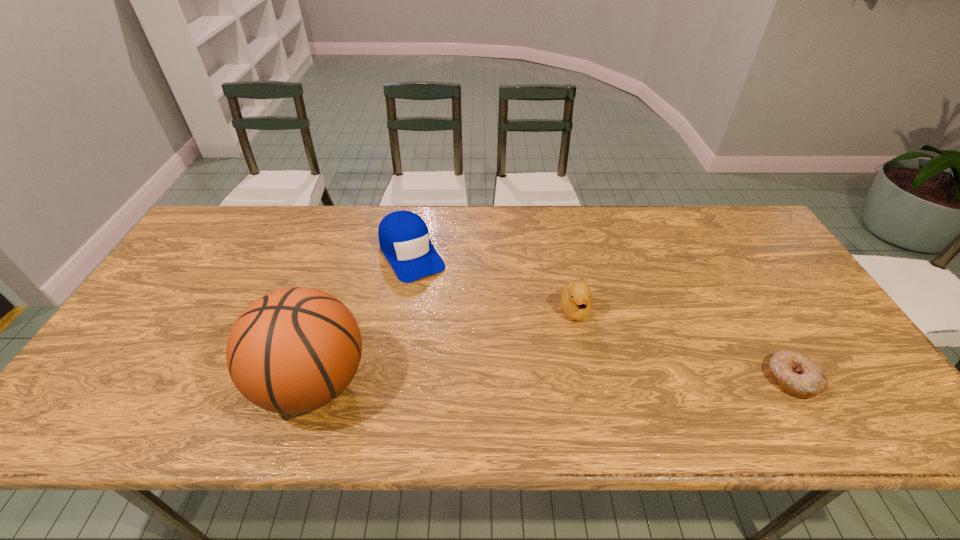
Locate an element on the screen. Image resolution: width=960 pixels, height=540 pixels. unoccupied position between the doughnut and the farthest object is located at coordinates (602, 316).

Identify the location of free spot between the third nearest object and the tallest object. (444, 346).

Where is `free space between the farthest object and the shortest object`? free space between the farthest object and the shortest object is located at coordinates (602, 316).

Locate which object ranks third in proximity to the second object from right to left. Please provide its 2D coordinates. Your answer should be formatted as a tuple, i.e. [(x, y)], where the tuple contains the x and y coordinates of a point satisfying the conditions above.

[(292, 351)]

Identify which object is located as the nearest to the doughnut. Please provide its 2D coordinates. Your answer should be formatted as a tuple, i.e. [(x, y)], where the tuple contains the x and y coordinates of a point satisfying the conditions above.

[(575, 297)]

The width and height of the screenshot is (960, 540). Identify the location of vacant position in the image that satisfies the following two spatial constraints: 1. on the back side of the basketball; 2. on the right side of the second farthest object. (336, 310).

The height and width of the screenshot is (540, 960). What are the coordinates of `free space in the image that satisfies the following two spatial constraints: 1. on the back side of the basketball; 2. on the right side of the doughnut` in the screenshot? It's located at (314, 379).

At what (x,y) coordinates should I click in order to perform the action: click on free space that satisfies the following two spatial constraints: 1. on the front side of the baseball cap; 2. on the left side of the rightmost object. Please return your answer as a coordinate pair (x, y). This screenshot has height=540, width=960. Looking at the image, I should click on (391, 379).

At what (x,y) coordinates should I click in order to perform the action: click on vacant region that satisfies the following two spatial constraints: 1. on the front side of the doughnut; 2. on the left side of the third object from left to right. Please return your answer as a coordinate pair (x, y). This screenshot has width=960, height=540. Looking at the image, I should click on (588, 379).